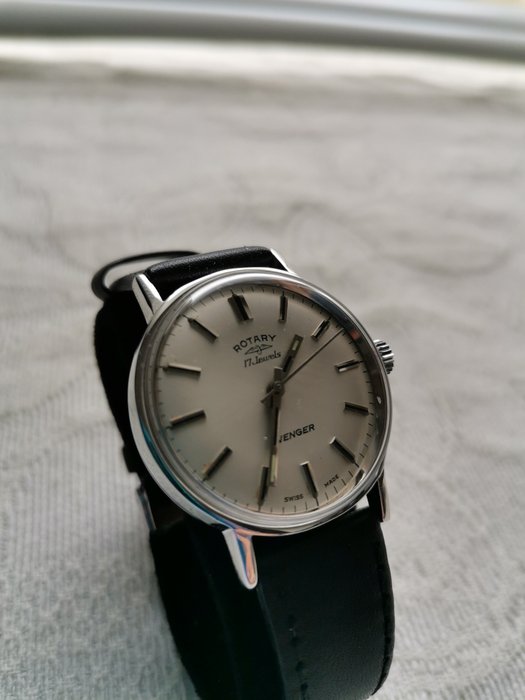
At what (x,y) coordinates should I click in order to perform the action: click on towel. Please return your answer as a coordinate pair (x, y). Looking at the image, I should click on (355, 239).